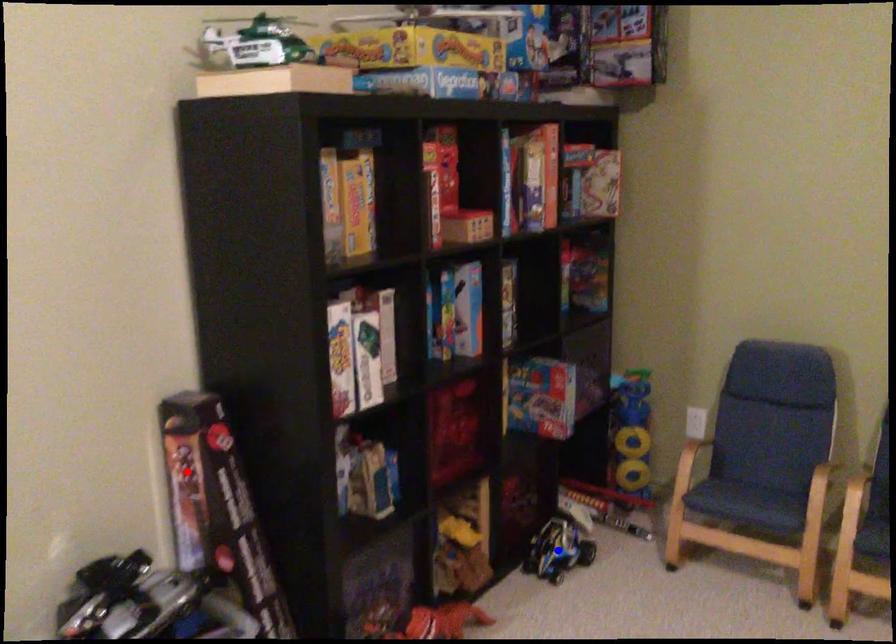
Question: Two points are marked on the image. Which point is closer to the camera?

Choices:
 (A) Blue point is closer.
 (B) Red point is closer.

Answer: (B)